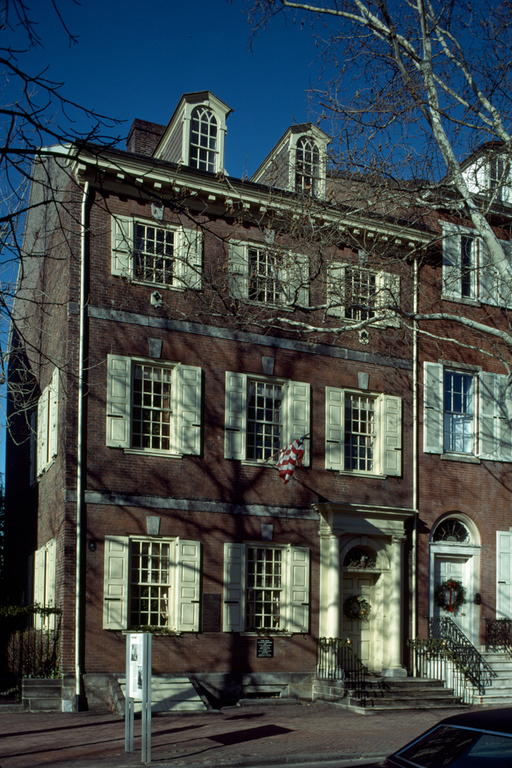
The height and width of the screenshot is (768, 512). In order to click on stairs in this screenshot , I will do pyautogui.click(x=408, y=694), pyautogui.click(x=492, y=680).